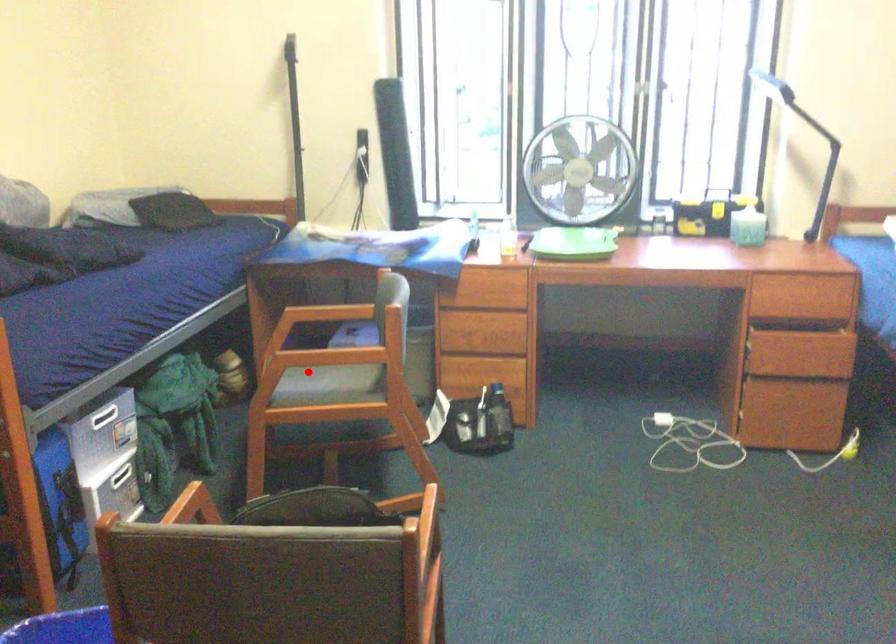
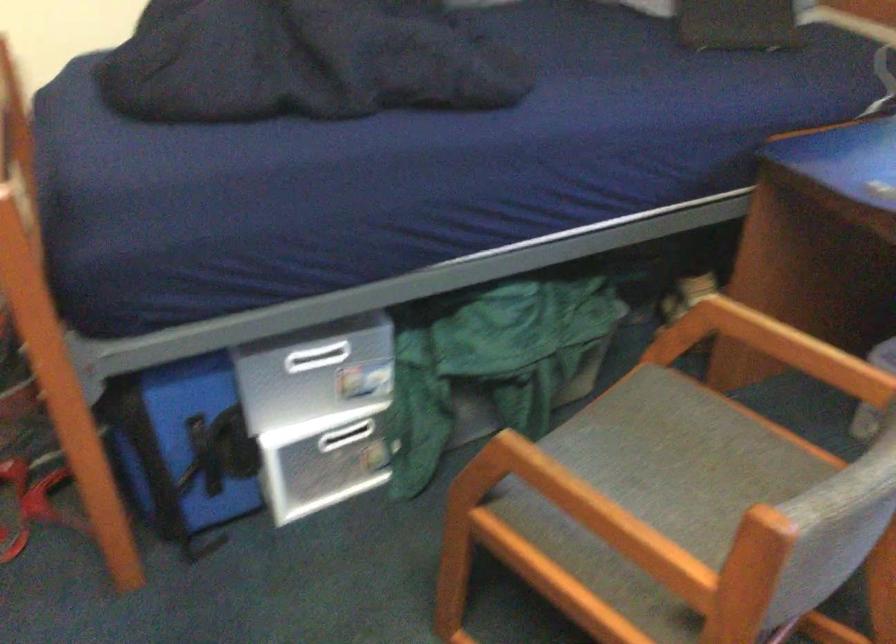
Where in the second image is the point corresponding to the highlighted location from the first image?

(677, 453)